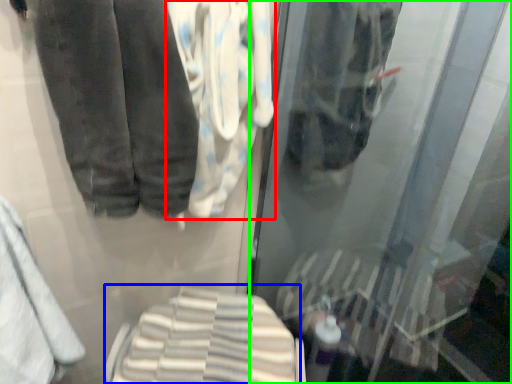
Question: Which object is positioned closest to cloth (highlighted by a red box)? Select from cloth (highlighted by a blue box) and shop window (highlighted by a green box).

Choices:
 (A) cloth
 (B) shop window

Answer: (B)